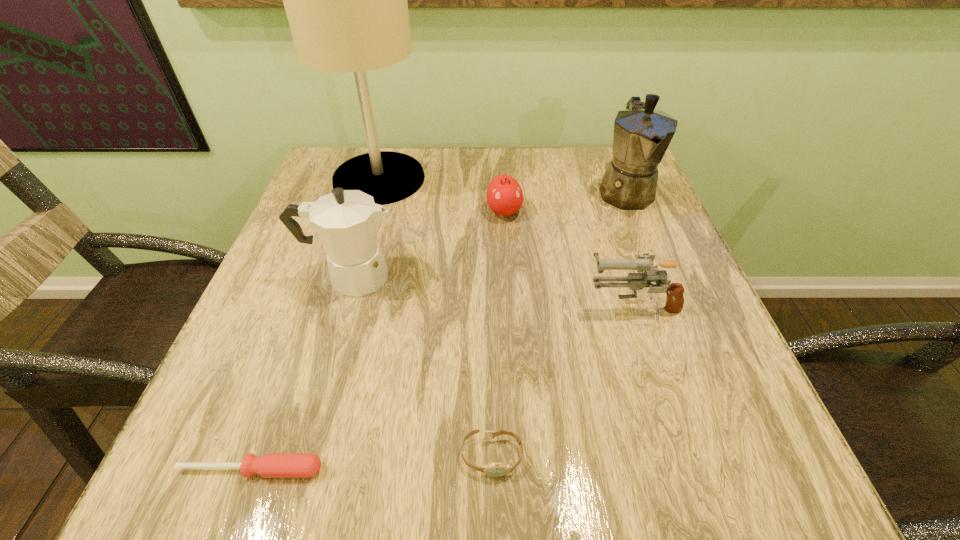
Locate an element on the screen. table lamp is located at coordinates [346, 2].

Identify the location of the taller coffeepot. Image resolution: width=960 pixels, height=540 pixels. (642, 135).

You are a GUI agent. You are given a task and a screenshot of the screen. Output one action in this format:
    pyautogui.click(x=<x>, y=<y>)
    Task: Click on the right coffeepot
    
    Given the screenshot: What is the action you would take?
    pyautogui.click(x=642, y=135)

Where is `the nearer coffeepot`? Image resolution: width=960 pixels, height=540 pixels. the nearer coffeepot is located at coordinates (346, 221).

Image resolution: width=960 pixels, height=540 pixels. What are the coordinates of `the shorter coffeepot` in the screenshot? It's located at (346, 221).

Locate an element on the screen. The image size is (960, 540). gun is located at coordinates (635, 281).

Identify the location of the third shortest object. This screenshot has width=960, height=540. tap(504, 196).

I want to click on the sixth tallest object, so click(496, 469).

Locate an element on the screen. This screenshot has width=960, height=540. the shortest object is located at coordinates (269, 465).

Image resolution: width=960 pixels, height=540 pixels. Find the location of `free space located 0.050m on the right of the tallest object`. free space located 0.050m on the right of the tallest object is located at coordinates (444, 179).